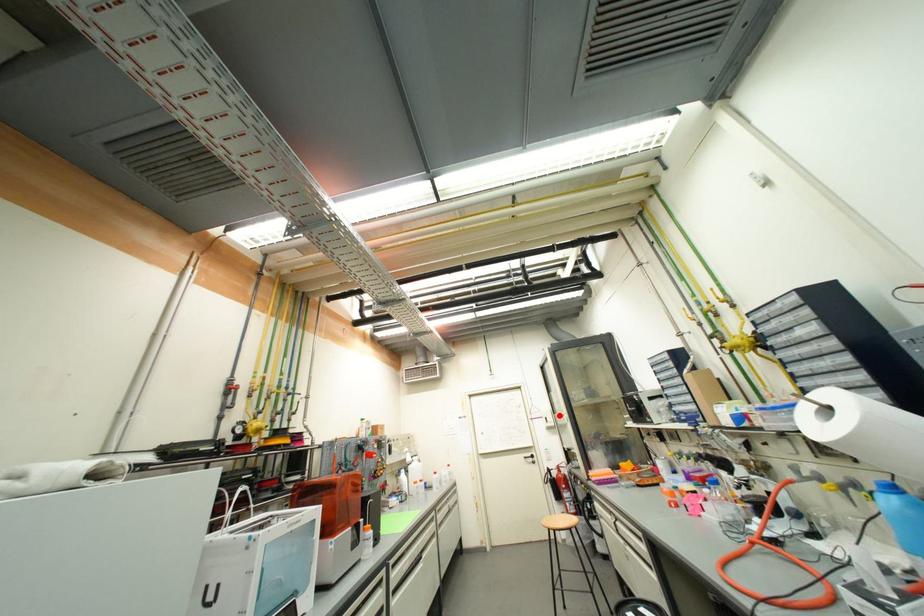
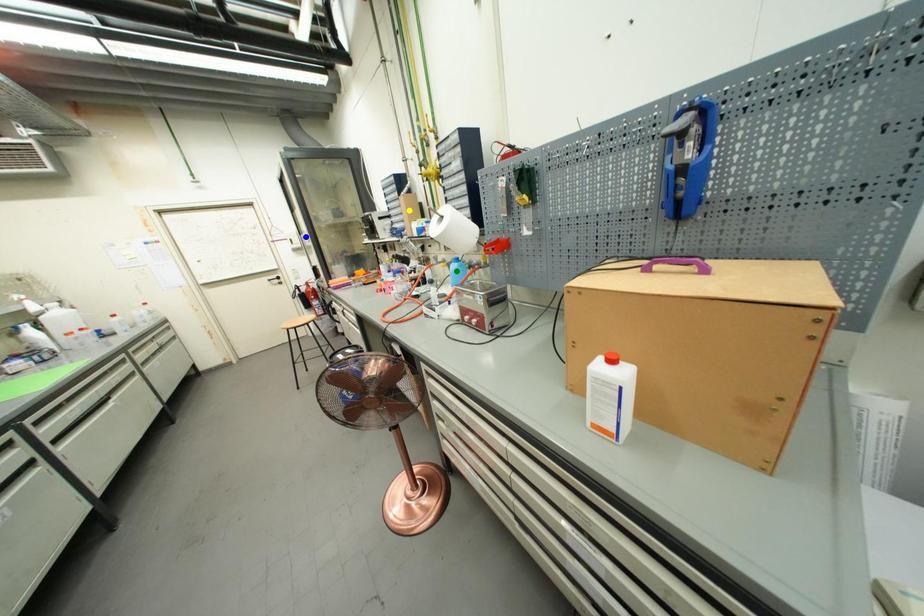
Question: I am providing you with two images of the same scene from different viewpoints. A red point is marked on the first image. You are given multiple points on the second image. Which point in image 2 represents the same 3d spot as the red point in image 1?

Choices:
 (A) blue point
 (B) green point
 (C) yellow point

Answer: (A)